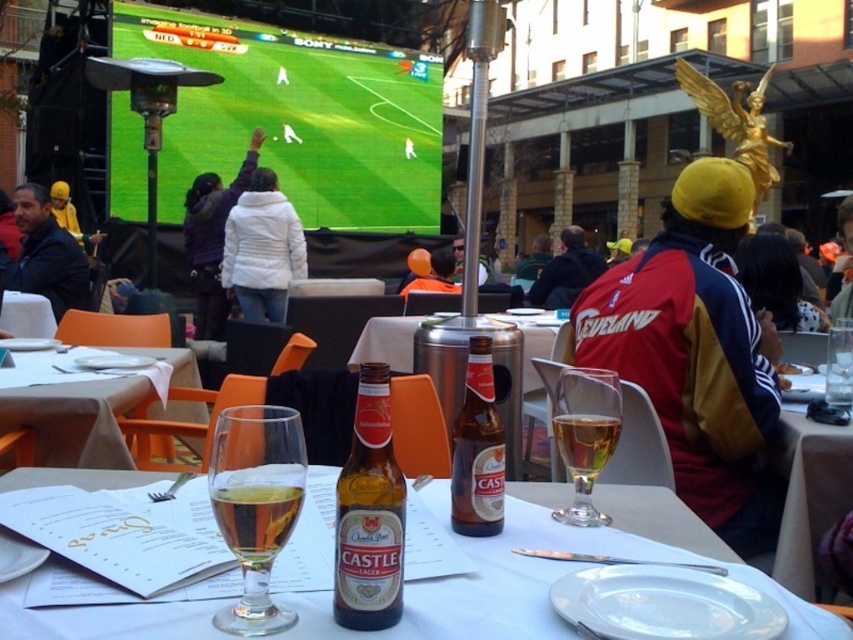
You are a customer at the sports bar and you want to choose between the yellow knit hat at upper center and the yellow knit cap at upper center to place your phone. Which one has enough height to support your phone without it falling over?

The yellow knit cap at upper center is taller than the yellow knit hat at upper center, so it can support the phone better without it falling over.

You are a waiter at the sports bar and need to place a new drink order on the table. The customer specified that the wine should be placed to the left of the beer. Can you confirm if the current arrangement of the clear glass wine glass at center and the clear glass beer at center already meets this requirement?

Yes, the clear glass wine glass at center is already positioned to the left of the clear glass beer at center, which aligns with the customer request.